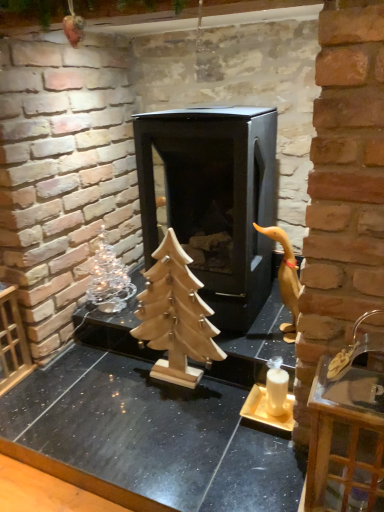
Find the location of a particular element. The width and height of the screenshot is (384, 512). vacant space to the left of wooden christmas tree at center is located at coordinates (112, 389).